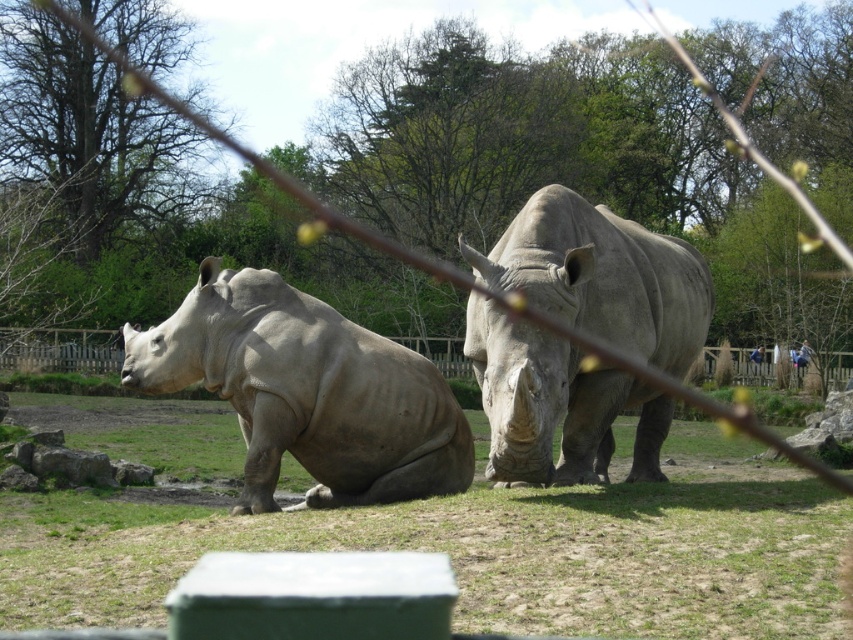
You are a zookeeper standing at the origin point of the coordinate system. You need to place a feeding station at the location of the green grass at center. What are the coordinates where you should place it?

The coordinates for the green grass at center are at point (486,548), so you should place the feeding station there.

You are a small animal trying to hide from the gray matte rhinoceros at center. Can you hide behind the green grass at center? Explain why or why not based on their sizes.

The green grass at center is much taller than the gray matte rhinoceros at center, so yes, the small animal can hide behind the green grass at center because it is taller than the rhinoceros.